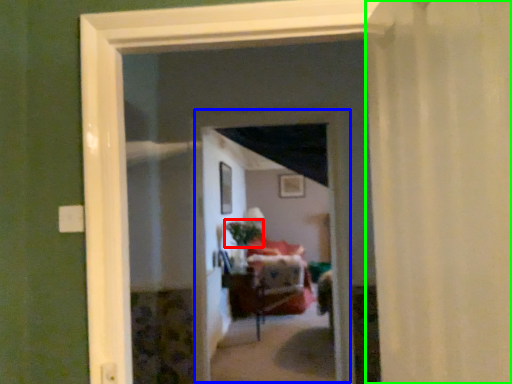
Question: Based on their relative distances, which object is nearer to plant (highlighted by a red box)? Choose from screen door (highlighted by a blue box) and curtain (highlighted by a green box).

Choices:
 (A) screen door
 (B) curtain

Answer: (A)